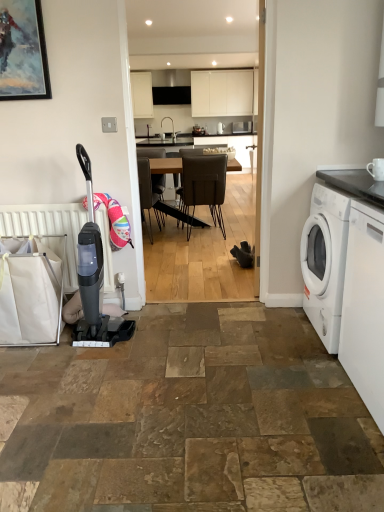
Question: Is white matte radiator at left aimed at white glossy washing machine at right, which appears as the 2th washing machine when viewed from the back?

Choices:
 (A) yes
 (B) no

Answer: (B)

Question: Does white matte radiator at left have a greater height compared to white glossy washing machine at right, which appears as the 2th washing machine when viewed from the back?

Choices:
 (A) no
 (B) yes

Answer: (A)

Question: Would you say white matte radiator at left is outside white glossy washing machine at right, which appears as the 2th washing machine when viewed from the back?

Choices:
 (A) no
 (B) yes

Answer: (B)

Question: Is white matte radiator at left positioned with its back to white glossy washing machine at right, the first washing machine viewed from the front?

Choices:
 (A) yes
 (B) no

Answer: (B)

Question: From the image's perspective, is white matte radiator at left located above white glossy washing machine at right, the first washing machine viewed from the front?

Choices:
 (A) yes
 (B) no

Answer: (A)

Question: From a real-world perspective, is black matte exhaust hood at upper center physically located above or below white glossy washing machine at right, which appears as the 2th washing machine when viewed from the back?

Choices:
 (A) above
 (B) below

Answer: (A)

Question: Considering the positions of black matte exhaust hood at upper center and white glossy washing machine at right, the first washing machine viewed from the front, in the image, is black matte exhaust hood at upper center bigger or smaller than white glossy washing machine at right, the first washing machine viewed from the front,?

Choices:
 (A) big
 (B) small

Answer: (A)

Question: From their relative heights in the image, would you say black matte exhaust hood at upper center is taller or shorter than white glossy washing machine at right, the first washing machine viewed from the front?

Choices:
 (A) short
 (B) tall

Answer: (A)

Question: Considering the positions of black matte exhaust hood at upper center and white glossy washing machine at right, which appears as the 2th washing machine when viewed from the back, in the image, is black matte exhaust hood at upper center wider or thinner than white glossy washing machine at right, which appears as the 2th washing machine when viewed from the back,?

Choices:
 (A) thin
 (B) wide

Answer: (A)

Question: From their relative heights in the image, would you say white matte washing machine at right, the 1th washing machine viewed from the back, is taller or shorter than black matte exhaust hood at upper center?

Choices:
 (A) short
 (B) tall

Answer: (B)

Question: From a real-world perspective, is white matte washing machine at right, the 1th washing machine viewed from the back, above or below black matte exhaust hood at upper center?

Choices:
 (A) above
 (B) below

Answer: (B)

Question: From the image's perspective, is white matte washing machine at right, the 2th washing machine in the front-to-back sequence, above or below black matte exhaust hood at upper center?

Choices:
 (A) below
 (B) above

Answer: (A)

Question: Considering the positions of white matte washing machine at right, the 2th washing machine in the front-to-back sequence, and black matte exhaust hood at upper center in the image, is white matte washing machine at right, the 2th washing machine in the front-to-back sequence, wider or thinner than black matte exhaust hood at upper center?

Choices:
 (A) wide
 (B) thin

Answer: (A)

Question: Is point (168, 172) closer or farther from the camera than point (188, 183)?

Choices:
 (A) closer
 (B) farther

Answer: (B)

Question: From the image's perspective, is wooden table at center positioned above or below brown leather chair at center?

Choices:
 (A) above
 (B) below

Answer: (A)